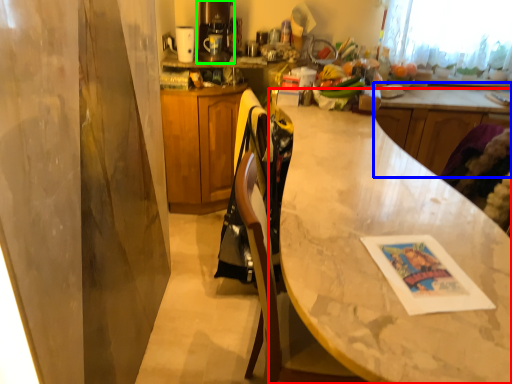
Question: Considering the real-world distances, which object is closest to countertop (highlighted by a red box)? counter (highlighted by a blue box) or coffee machine (highlighted by a green box).

Choices:
 (A) counter
 (B) coffee machine

Answer: (A)